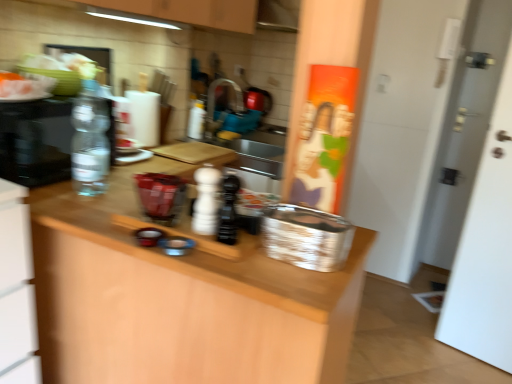
The height and width of the screenshot is (384, 512). What are the coordinates of `vacant region in front of silver metallic basket at center` in the screenshot? It's located at (301, 277).